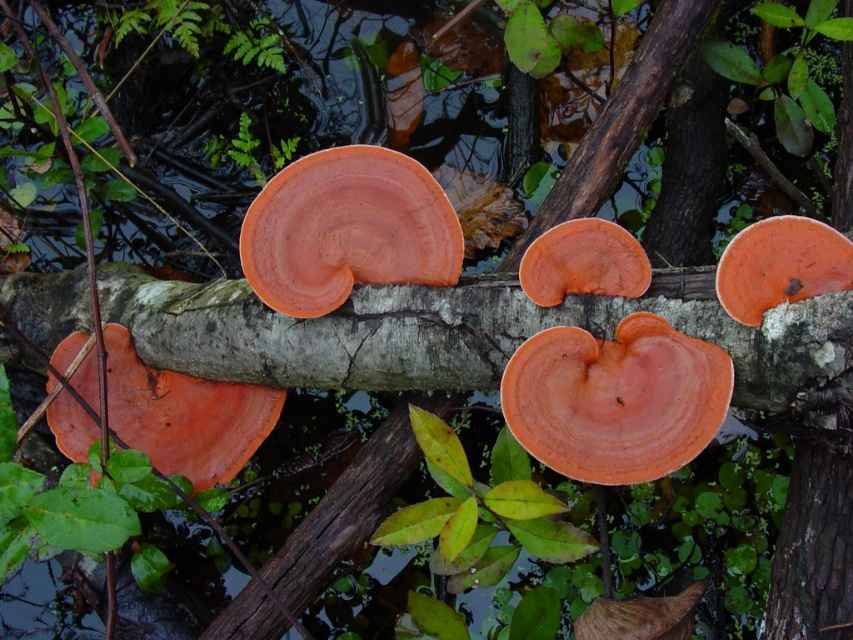
You are a nature photographer aiming to capture the orange matte fungus at center without the smooth bark tree trunk at right appearing in the foreground. Is this possible based on their positions?

The smooth bark tree trunk at right is behind the orange matte fungus at center, so yes, you can position the camera so that the orange matte fungus at center blocks the view of the smooth bark tree trunk at right, achieving the desired composition.

You are a nature photographer aiming to capture the orange matte fungus at center and the smooth bark tree trunk at right in a single frame. Based on their sizes, which object should you focus on first to ensure both fit in the shot?

The orange matte fungus at center is bigger than the smooth bark tree trunk at right, so you should focus on the orange matte fungus at center first to ensure both fit in the shot.